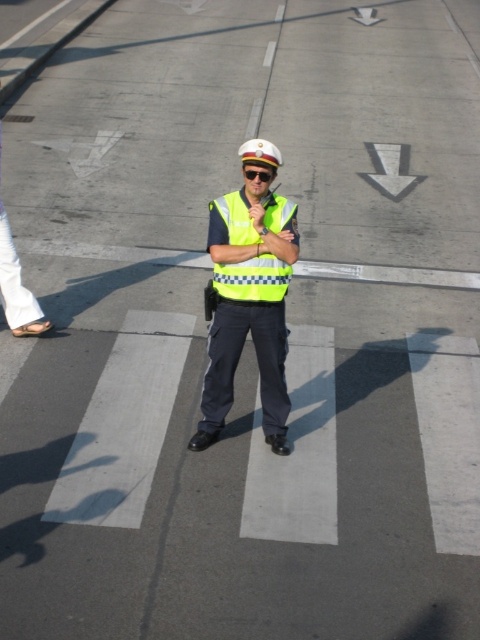
Question: Among these points, which one is nearest to the camera?

Choices:
 (A) pos(276,272)
 (B) pos(215,330)

Answer: (A)

Question: Observing the image, what is the correct spatial positioning of reflective yellow vest at center in reference to yellow reflective safety vest at center?

Choices:
 (A) above
 (B) below

Answer: (B)

Question: Which of the following is the farthest from the observer?

Choices:
 (A) yellow reflective safety vest at center
 (B) reflective yellow vest at center

Answer: (A)

Question: Is reflective yellow vest at center to the right of yellow reflective safety vest at center from the viewer's perspective?

Choices:
 (A) no
 (B) yes

Answer: (A)

Question: Is reflective yellow vest at center thinner than yellow reflective safety vest at center?

Choices:
 (A) no
 (B) yes

Answer: (A)